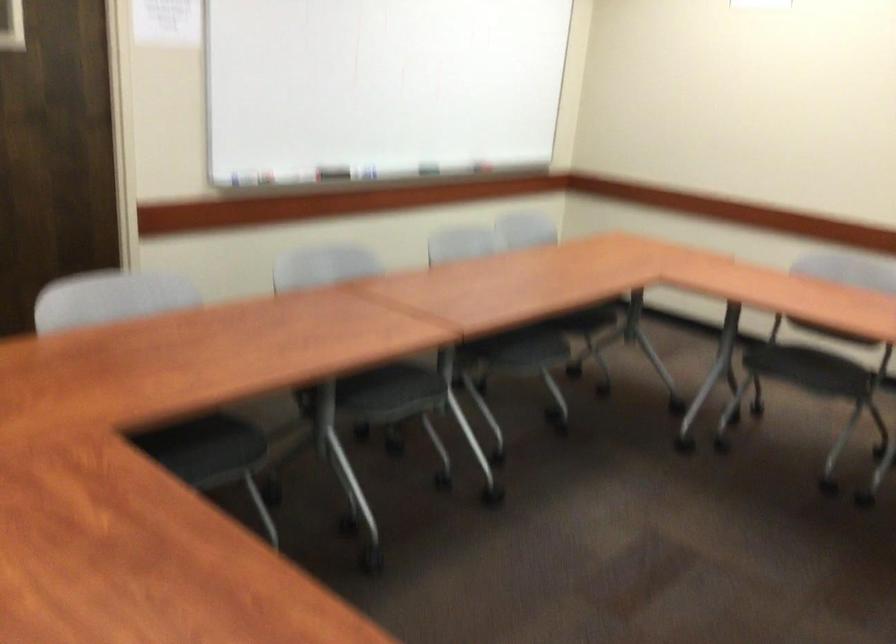
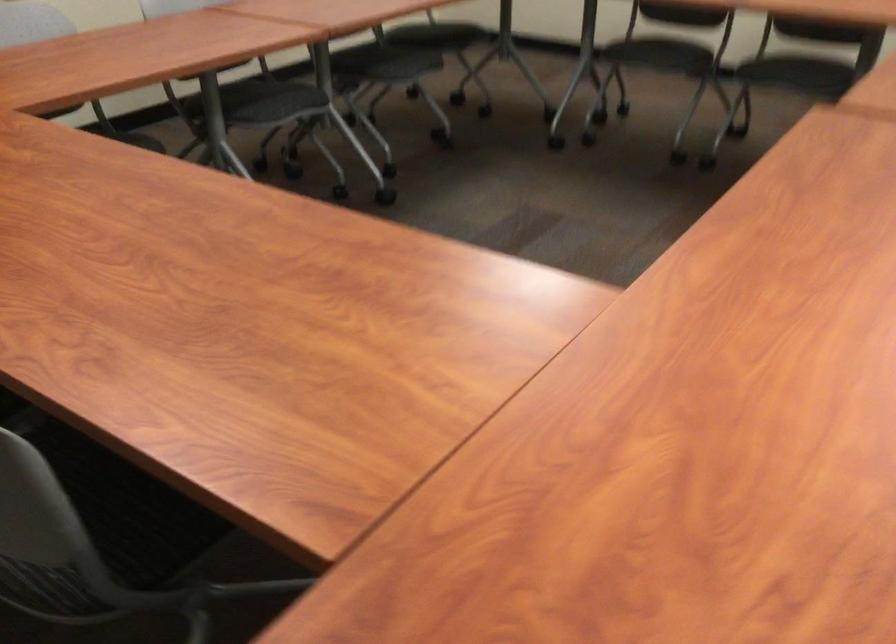
Question: Which direction would the cameraman need to move to produce the second image? Reply with the corresponding letter.

Choices:
 (A) Left
 (B) Right
 (C) Forward
 (D) Backward

Answer: (D)